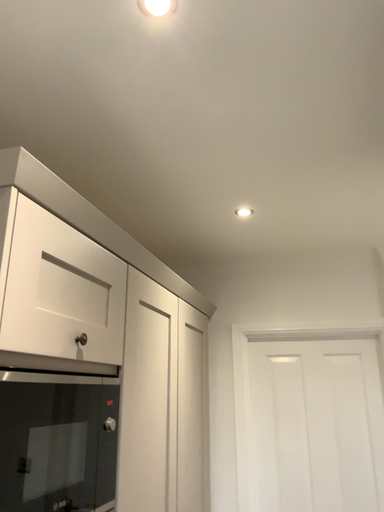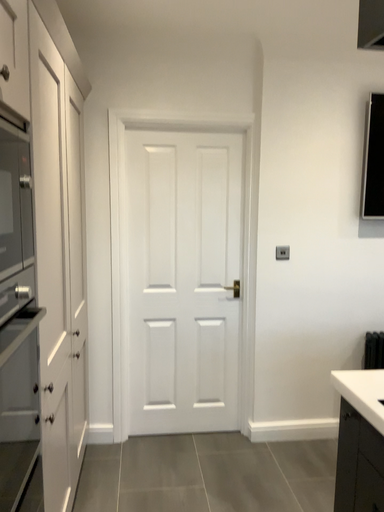
Question: How did the camera likely rotate when shooting the video?

Choices:
 (A) rotated downward
 (B) rotated upward

Answer: (A)